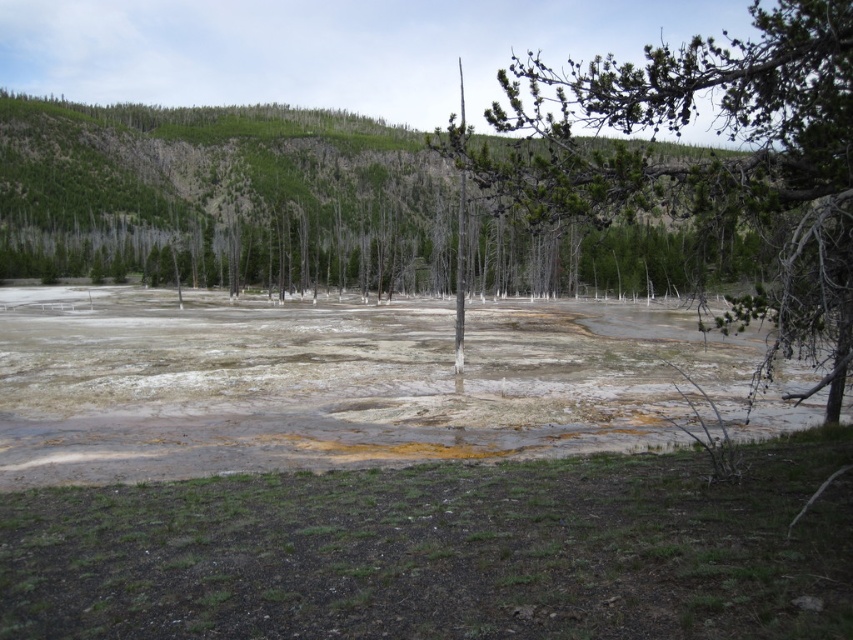
Question: Which point is farther from the camera taking this photo?

Choices:
 (A) (775, 116)
 (B) (276, 432)
 (C) (201, 257)

Answer: (C)

Question: Can you confirm if yellowish sedimentary water at center is wider than green forested hillside at upper center?

Choices:
 (A) yes
 (B) no

Answer: (B)

Question: In this image, where is green forested hillside at upper center located relative to green leafy tree at center?

Choices:
 (A) below
 (B) above

Answer: (A)

Question: Is green forested hillside at upper center to the right of green leafy tree at center from the viewer's perspective?

Choices:
 (A) yes
 (B) no

Answer: (B)

Question: Which of the following is the farthest from the observer?

Choices:
 (A) green leafy tree at center
 (B) green forested hillside at upper center
 (C) yellowish sedimentary water at center

Answer: (C)

Question: Which of the following is the farthest from the observer?

Choices:
 (A) (700, 90)
 (B) (200, 236)
 (C) (693, 355)

Answer: (A)